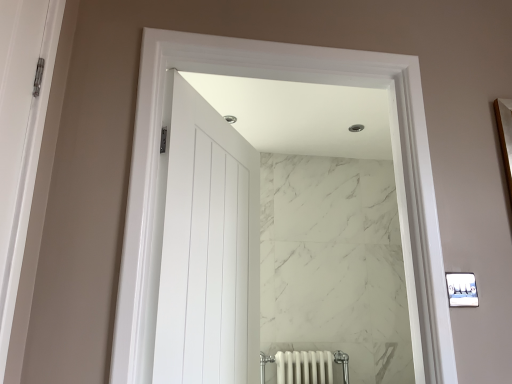
What are the coordinates of `white marble wall at center` in the screenshot? It's located at (288, 80).

Describe the element at coordinates (288, 80) in the screenshot. The width and height of the screenshot is (512, 384). I see `white marble wall at center` at that location.

Measure the distance between white marble wall at center and camera.

white marble wall at center and camera are 34.48 inches apart from each other.

The image size is (512, 384). What do you see at coordinates (206, 248) in the screenshot?
I see `white glossy door at center` at bounding box center [206, 248].

This screenshot has width=512, height=384. Find the location of `white glossy door at center`. white glossy door at center is located at coordinates (206, 248).

This screenshot has width=512, height=384. What are the coordinates of `white marble wall at center` in the screenshot? It's located at (288, 80).

Based on their positions, is white glossy door at center located to the left or right of white marble wall at center?

white glossy door at center is positioned on white marble wall at center's left side.

Which object is further away from the camera, white glossy door at center or white marble wall at center?

white glossy door at center.

Is point (216, 295) positioned after point (150, 126)?

Yes, it is.

From the image's perspective, is white glossy door at center on white marble wall at center?

No.

From a real-world perspective, is white glossy door at center positioned above or below white marble wall at center?

white glossy door at center is situated lower than white marble wall at center in the real world.

Considering the sizes of objects white glossy door at center and white marble wall at center in the image provided, who is wider, white glossy door at center or white marble wall at center?

Wider between the two is white glossy door at center.

Is white glossy door at center taller or shorter than white marble wall at center?

Considering their sizes, white glossy door at center has more height than white marble wall at center.

Considering the sizes of objects white glossy door at center and white marble wall at center in the image provided, who is bigger, white glossy door at center or white marble wall at center?

white glossy door at center is bigger.

Is white glossy door at center inside or outside of white marble wall at center?

white glossy door at center exists outside the volume of white marble wall at center.

Is white glossy door at center next to white marble wall at center?

No, white glossy door at center is not beside white marble wall at center.

Is white glossy door at center turned away from white marble wall at center?

Correct, white glossy door at center is looking away from white marble wall at center.

How different are the orientations of white glossy door at center and white marble wall at center in degrees?

The facing directions of white glossy door at center and white marble wall at center are 121 degrees apart.

This screenshot has width=512, height=384. Identify the location of door on the left of the white marble wall at center. (206, 248).

Considering the relative positions of white marble wall at center and white glossy door at center in the image provided, is white marble wall at center to the left or to the right of white glossy door at center?

In the image, white marble wall at center appears on the right side of white glossy door at center.

In the scene shown: Considering their positions, is white marble wall at center located in front of or behind white glossy door at center?

white marble wall at center is positioned closer to the viewer than white glossy door at center.

Which is less distant, (160, 64) or (218, 319)?

The point (160, 64) is closer to the camera.

From the image's perspective, between white marble wall at center and white glossy door at center, which one is located above?

From the image's view, white marble wall at center is above.

Looking at this image, from a real-world perspective, is white marble wall at center above or below white glossy door at center?

In terms of real-world spatial position, white marble wall at center is above white glossy door at center.

Considering the relative sizes of white marble wall at center and white glossy door at center in the image provided, is white marble wall at center wider than white glossy door at center?

Incorrect, the width of white marble wall at center does not surpass that of white glossy door at center.

Does white marble wall at center have a lesser height compared to white glossy door at center?

Correct, white marble wall at center is not as tall as white glossy door at center.

Does white marble wall at center have a smaller size compared to white glossy door at center?

Yes.

Would you say white marble wall at center contains white glossy door at center?

No.

Would you consider white marble wall at center to be distant from white glossy door at center?

No, white marble wall at center is not far away from white glossy door at center.

Is white marble wall at center looking in the opposite direction of white glossy door at center?

No, white marble wall at center's orientation is not away from white glossy door at center.

This screenshot has width=512, height=384. Find the location of `door below the white marble wall at center (from a real-world perspective)`. door below the white marble wall at center (from a real-world perspective) is located at coordinates (206, 248).

I want to click on window that is above the white glossy door at center (from a real-world perspective), so click(x=288, y=80).

Locate an element on the screen. The height and width of the screenshot is (384, 512). door behind the white marble wall at center is located at coordinates (206, 248).